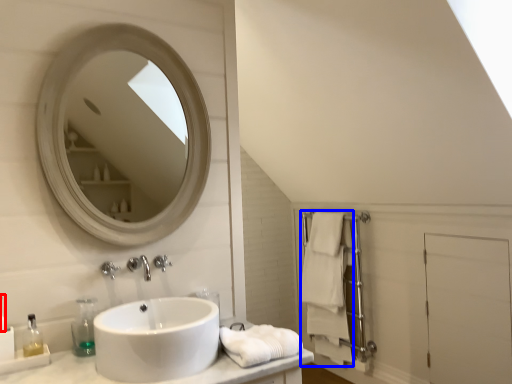
Question: Which of the following is the farthest to the observer, toiletry (highlighted by a red box) or bath towel (highlighted by a blue box)?

Choices:
 (A) toiletry
 (B) bath towel

Answer: (B)